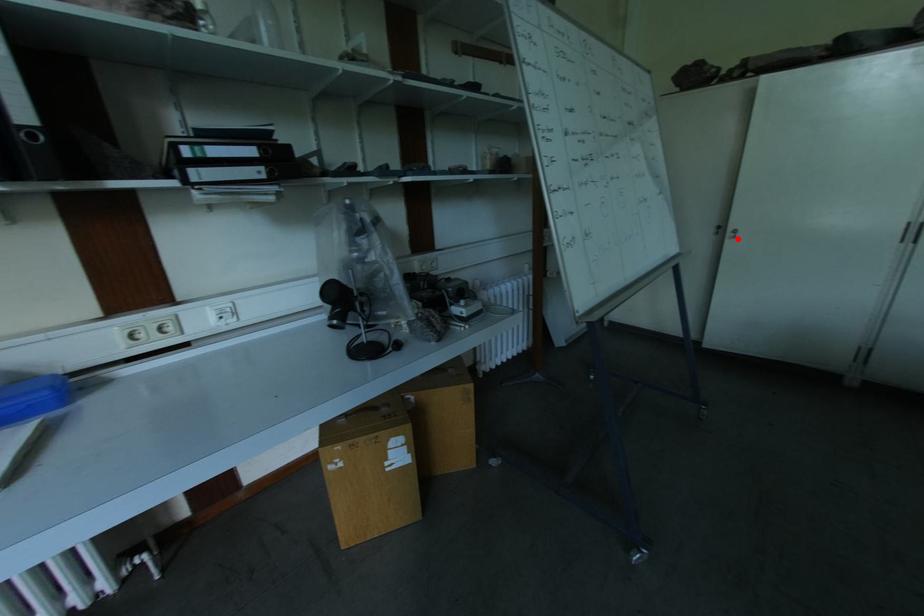
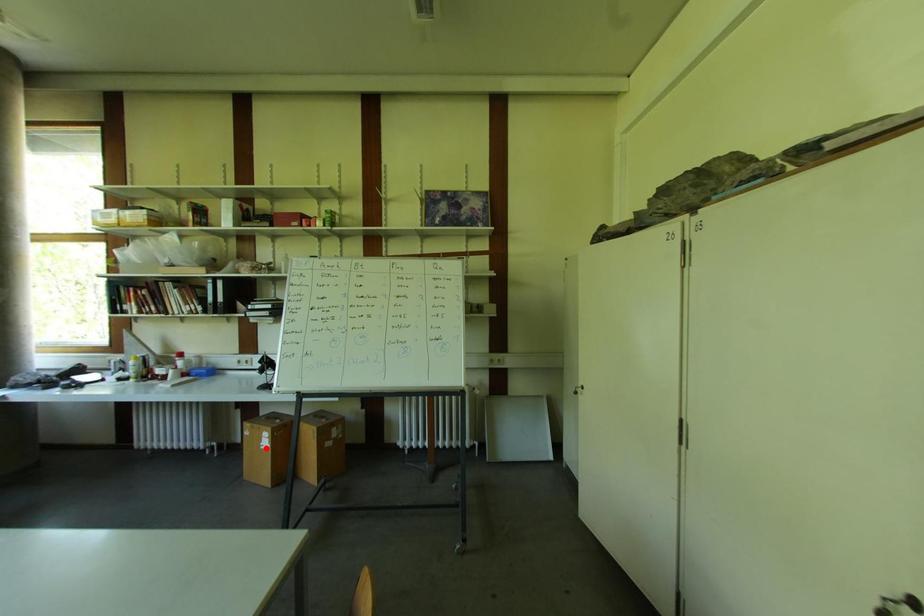
I am providing you with two images of the same scene from different viewpoints. A red point is marked on the first image and another point is marked on the second image. Is the marked point in image1 the same physical position as the marked point in image2?

→ No